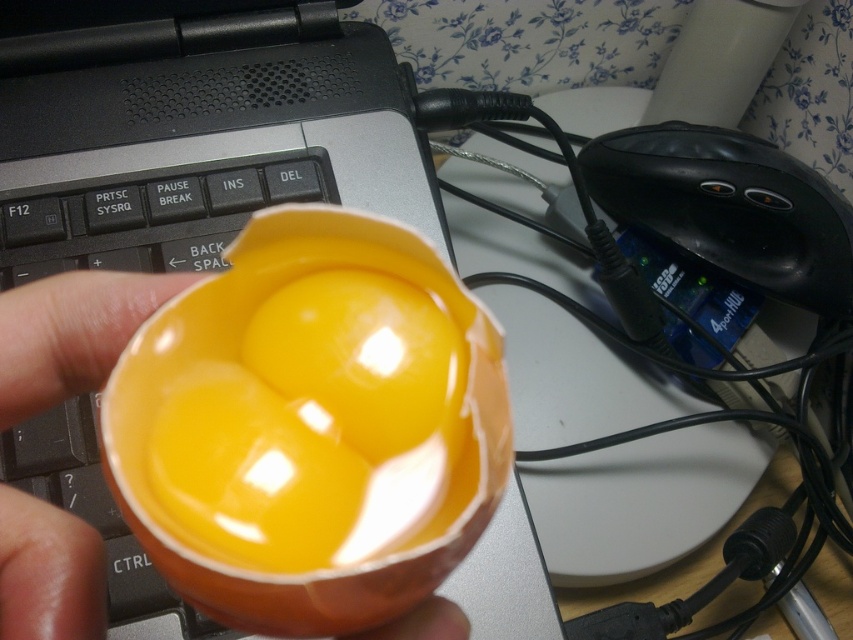
You are taking a photo of the orange ceramic bowl. You want to focus on the point that is closer to the camera. Which point should you choose between point (318, 428) and point (54, 220)?

Point (318, 428) is closer to the camera than point (54, 220), so you should focus on point (318, 428).

You are organizing items on a desk and need to place the orange glossy egg at center and the black matte keyboard at center. Which item takes up more space on the desk?

The black matte keyboard at center takes up more space because the orange glossy egg at center is smaller than it.